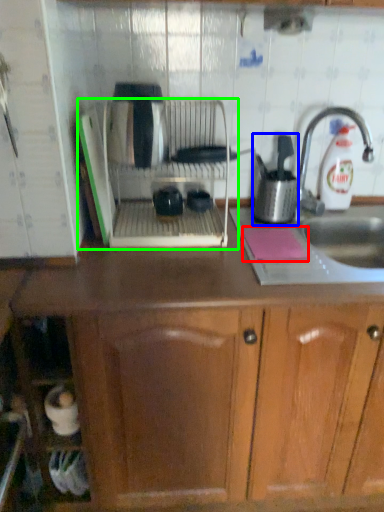
Question: Which is nearer to the notepad (highlighted by a red box)? kitchen appliance (highlighted by a blue box) or home appliance (highlighted by a green box).

Choices:
 (A) kitchen appliance
 (B) home appliance

Answer: (A)